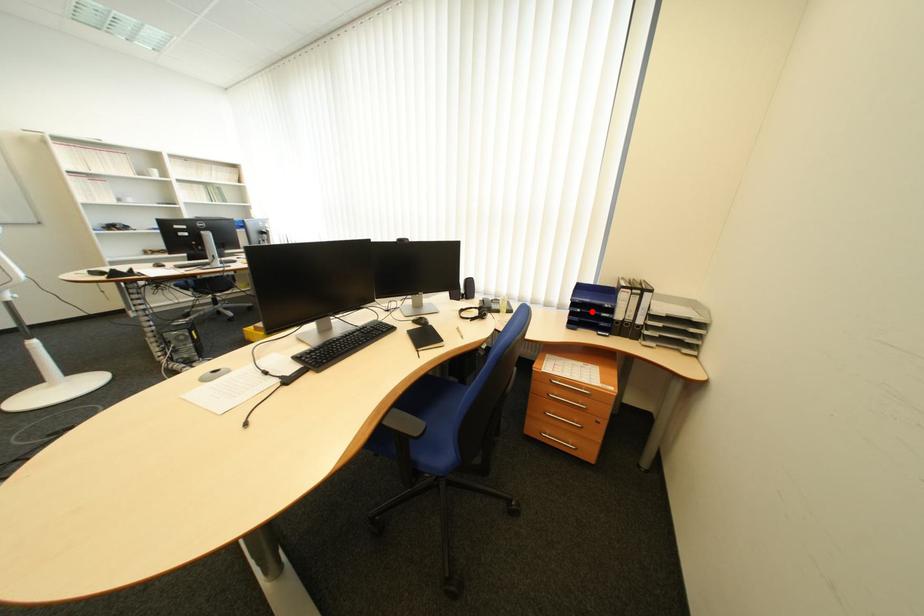
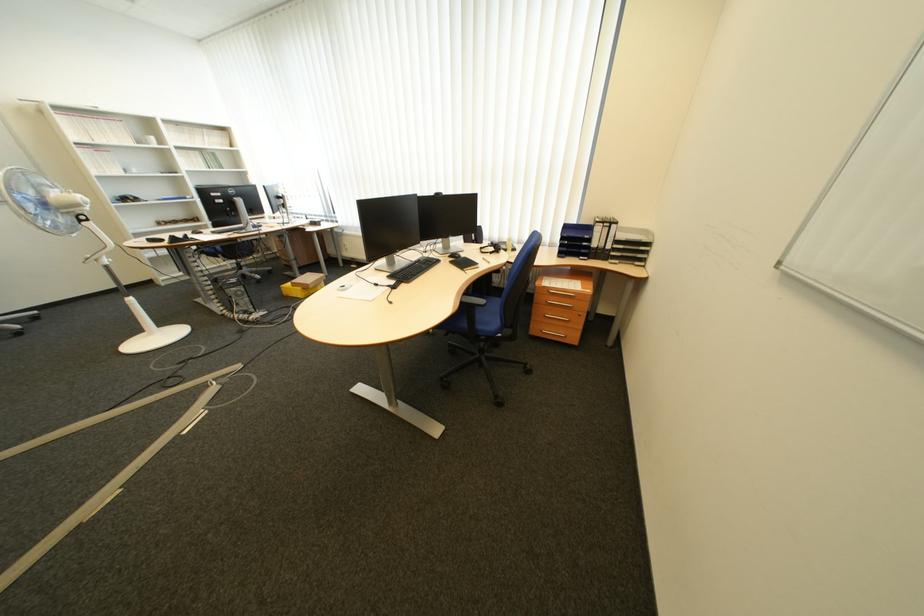
Where in the second image is the point corresponding to the highlighted location from the first image?

(579, 244)